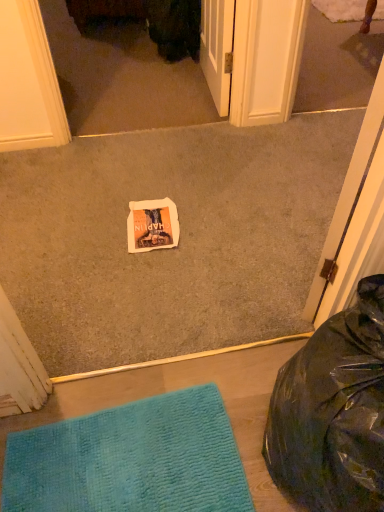
You are a GUI agent. You are given a task and a screenshot of the screen. Output one action in this format:
    pyautogui.click(x=<x>, y=<y>)
    Task: Click on the empty space that is ontop of matte white screen door at upper center
    
    Given the screenshot: What is the action you would take?
    pyautogui.click(x=105, y=55)